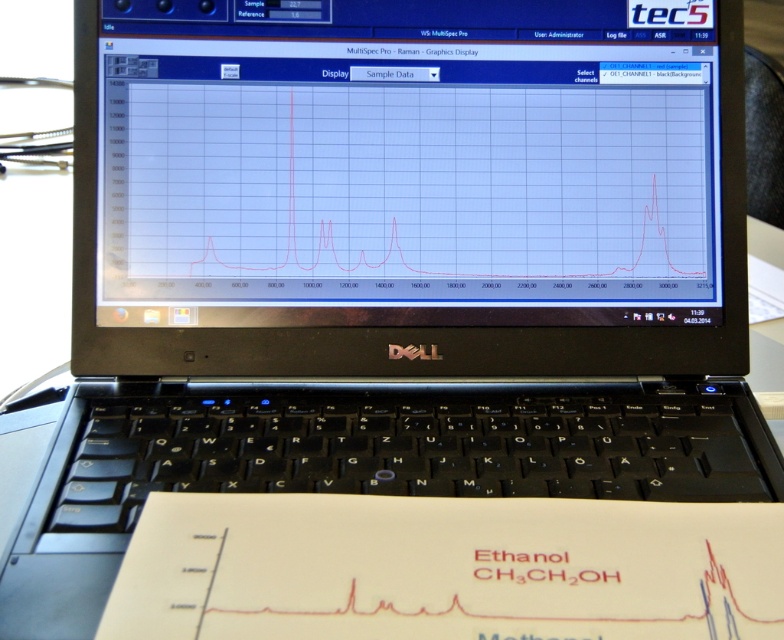
Describe the element at coordinates (407, 163) in the screenshot. Image resolution: width=784 pixels, height=640 pixels. I see `matte black screen at center` at that location.

Who is positioned more to the left, matte black screen at center or white paper at lower center?

Positioned to the left is matte black screen at center.

Which is in front, point (605, 61) or point (118, 570)?

Point (118, 570) is in front.

Locate an element on the screen. matte black screen at center is located at coordinates (407, 163).